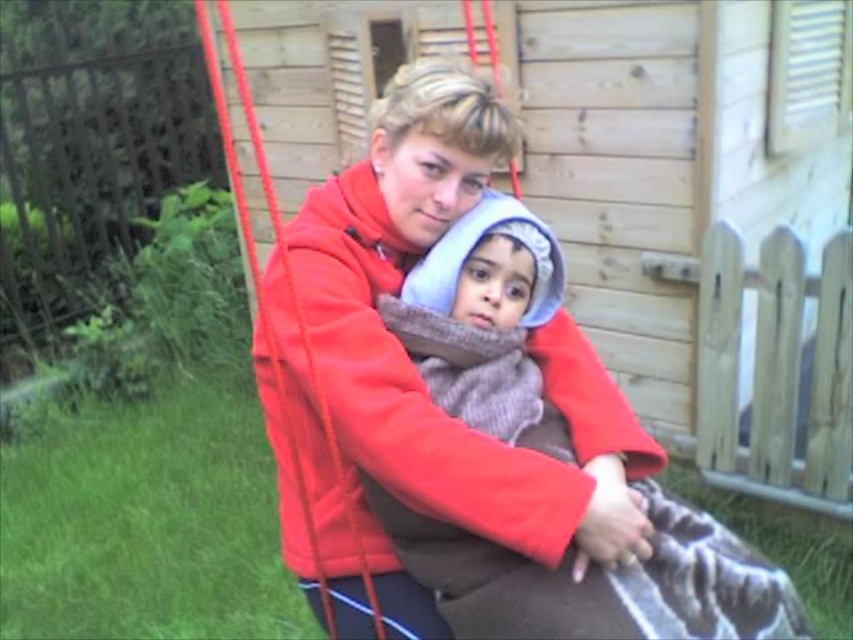
You are a tailor who needs to measure the space between two items in the image. You see the matte fleece jacket at center and the knitted wool scarf at center. Can you determine if there is enough space between them to fit a 4.5 inch wide fabric panel?

The distance between the matte fleece jacket at center and the knitted wool scarf at center is 4.30 inches, which is slightly less than the 4.5 inch wide fabric panel. Therefore, the fabric panel will not fit between them.

You are a photographer trying to capture a closeup of the knitted wool scarf at center without including the matte fleece jacket at center in the frame. Based on their positions, is this possible?

The matte fleece jacket at center is above the knitted wool scarf at center, so if you position the camera below the scarf, you can capture the scarf without the jacket in the frame.